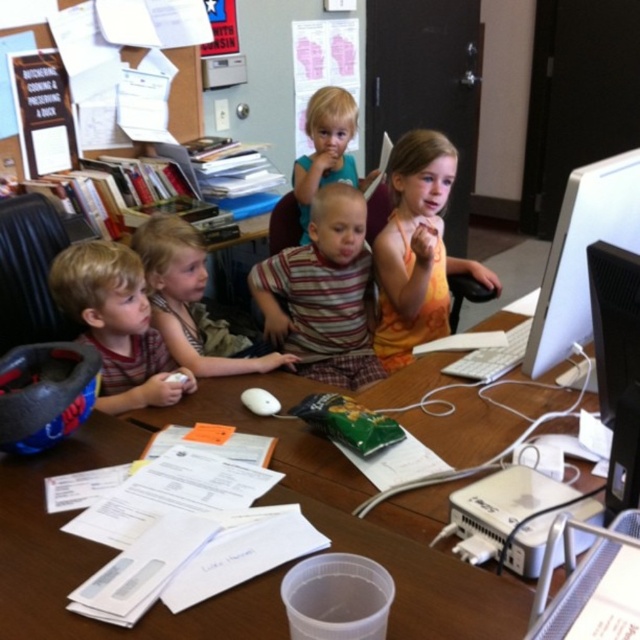
Between orange fabric dress at center and blonde hair at upper center, which one has more height?

Standing taller between the two is orange fabric dress at center.

Is point (397, 282) positioned in front of point (305, 200)?

Yes, point (397, 282) is in front of point (305, 200).

Describe the element at coordinates (417, 248) in the screenshot. I see `orange fabric dress at center` at that location.

What are the coordinates of `orange fabric dress at center` in the screenshot? It's located at (417, 248).

Can you confirm if clear plastic cup at center is positioned above white glossy computer monitor at right?

No, clear plastic cup at center is not above white glossy computer monitor at right.

Can you confirm if clear plastic cup at center is wider than white glossy computer monitor at right?

Yes.

Is point (452, 627) closer to viewer compared to point (620, 184)?

Yes, it is in front of point (620, 184).

Where is `clear plastic cup at center`? clear plastic cup at center is located at coordinates (99, 556).

Does orange fabric dress at center have a larger size compared to white matte mouse at center?

Indeed, orange fabric dress at center has a larger size compared to white matte mouse at center.

Is orange fabric dress at center to the left of white matte mouse at center from the viewer's perspective?

Incorrect, orange fabric dress at center is not on the left side of white matte mouse at center.

Describe the element at coordinates (417, 248) in the screenshot. I see `orange fabric dress at center` at that location.

In order to click on orange fabric dress at center in this screenshot , I will do `click(417, 248)`.